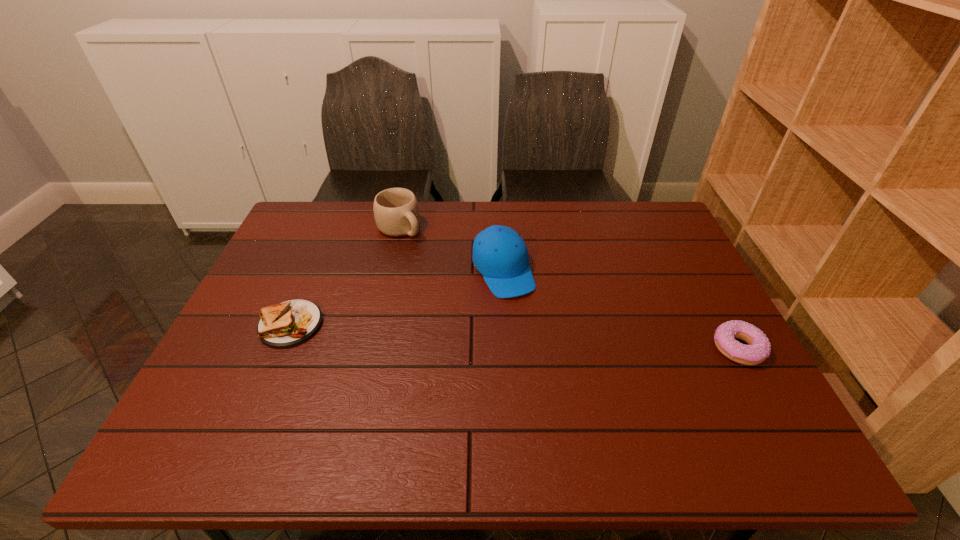
At what (x,y) coordinates should I click in order to perform the action: click on sandwich. Please return your answer as a coordinate pair (x, y). The image size is (960, 540). Looking at the image, I should click on (289, 323).

Find the location of a particular element. The width and height of the screenshot is (960, 540). the rightmost object is located at coordinates pyautogui.click(x=759, y=348).

Image resolution: width=960 pixels, height=540 pixels. Find the location of `the second object from left to right`. the second object from left to right is located at coordinates (396, 212).

Locate an element on the screen. The height and width of the screenshot is (540, 960). mug is located at coordinates (396, 212).

This screenshot has width=960, height=540. What are the coordinates of `the second object from right to left` in the screenshot? It's located at (500, 254).

You are a GUI agent. You are given a task and a screenshot of the screen. Output one action in this format:
    pyautogui.click(x=<x>, y=<y>)
    Task: Click on the cap
    Image resolution: width=960 pixels, height=540 pixels.
    Given the screenshot: What is the action you would take?
    pyautogui.click(x=500, y=254)

Find the location of a particular element. vacant area situated on the right of the leftmost object is located at coordinates (431, 325).

The image size is (960, 540). What are the coordinates of `vacant space located on the left of the doughnut` in the screenshot? It's located at (672, 348).

Locate an element on the screen. Image resolution: width=960 pixels, height=540 pixels. free space located 0.360m on the side of the mug with the handle is located at coordinates (487, 300).

The image size is (960, 540). Find the location of `vacant space located 0.140m on the side of the mug with the handle`. vacant space located 0.140m on the side of the mug with the handle is located at coordinates (439, 261).